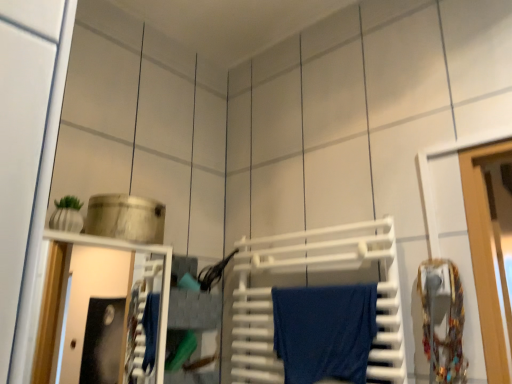
Where is `blank space situated above blue cotton towel at center (from a real-world perspective)`? blank space situated above blue cotton towel at center (from a real-world perspective) is located at coordinates (321, 287).